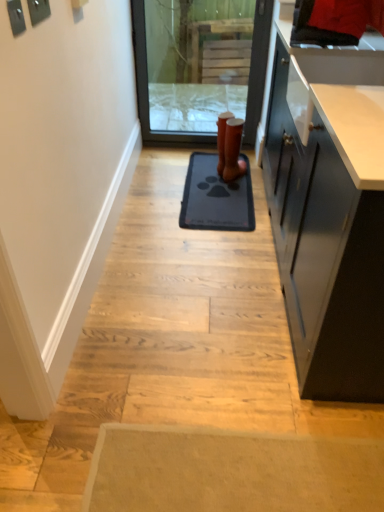
Question: From the image's perspective, is gray rubber mat at center located above or below brown leather boot at center?

Choices:
 (A) below
 (B) above

Answer: (A)

Question: Is gray rubber mat at center situated inside brown leather boot at center or outside?

Choices:
 (A) inside
 (B) outside

Answer: (B)

Question: Estimate the real-world distances between objects in this image. Which object is farther from the transparent glass screen door at center?

Choices:
 (A) gray rubber mat at center
 (B) brown leather boot at center

Answer: (A)

Question: Considering the real-world distances, which object is farthest from the brown leather boot at center?

Choices:
 (A) transparent glass screen door at center
 (B) gray rubber mat at center

Answer: (A)